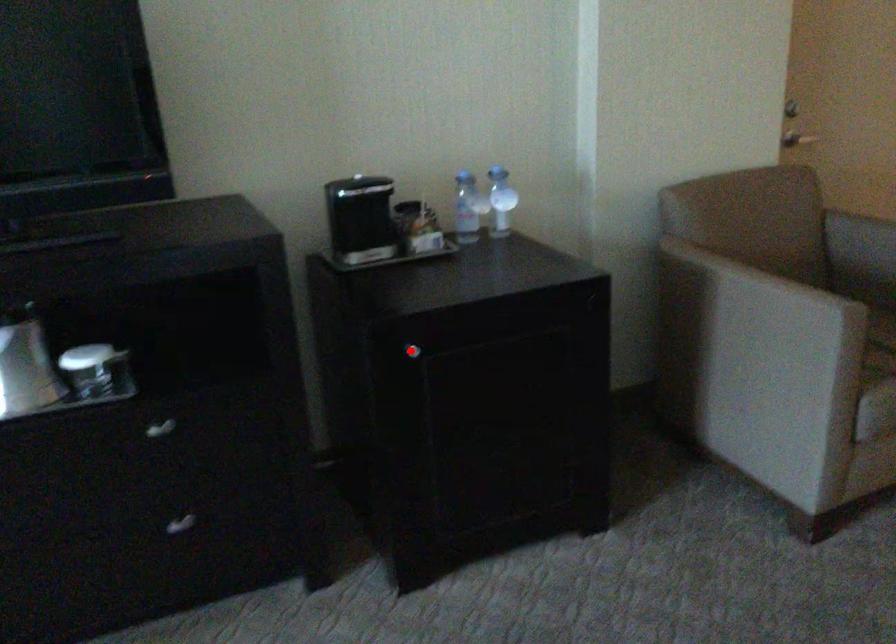
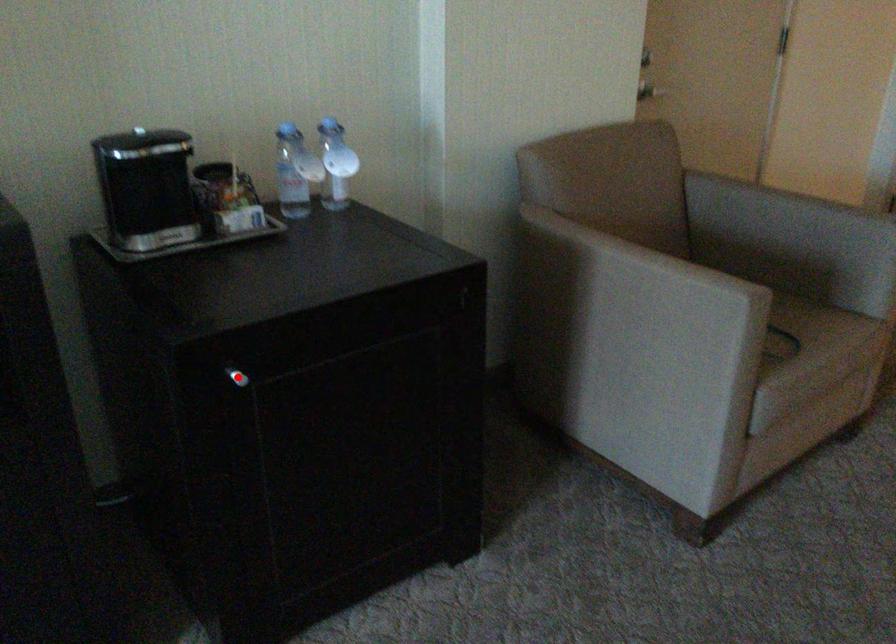
I am providing you with two images of the same scene from different viewpoints. A red point is marked on the first image and another point is marked on the second image. Is the marked point in image1 the same physical position as the marked point in image2?

A: Yes